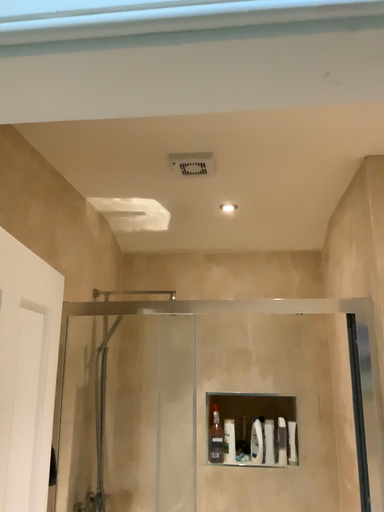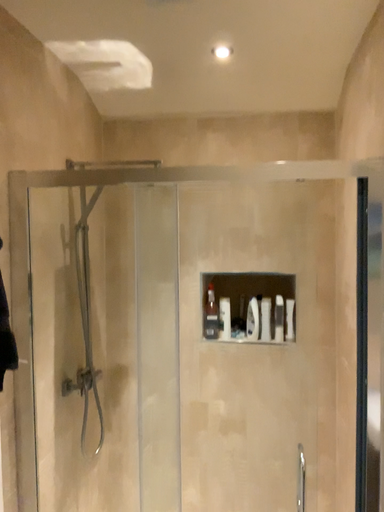
Question: Which way did the camera rotate in the video?

Choices:
 (A) rotated downward
 (B) rotated upward

Answer: (A)